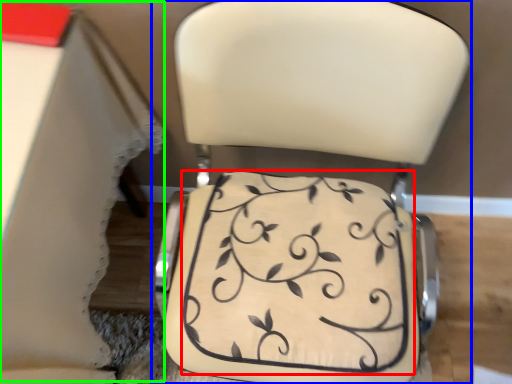
Question: Which object is the farthest from wedding cake (highlighted by a red box)? Choose among these: chair (highlighted by a blue box) or table (highlighted by a green box).

Choices:
 (A) chair
 (B) table

Answer: (B)